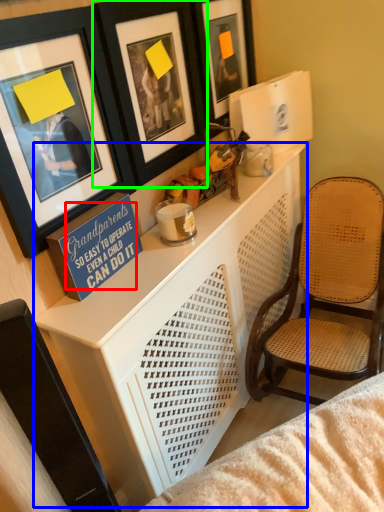
Question: Which object is positioned farthest from writing (highlighted by a red box)? Select from table (highlighted by a blue box) and picture frame (highlighted by a green box).

Choices:
 (A) table
 (B) picture frame

Answer: (B)